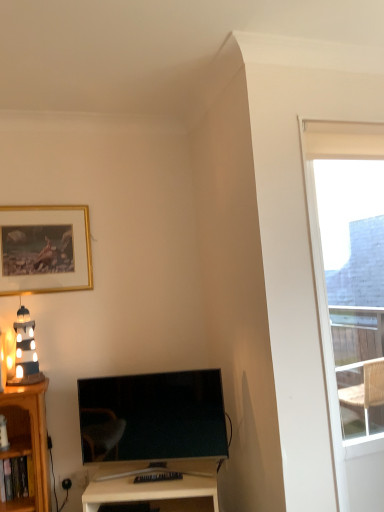
From the picture: Measure the distance between white glossy desk at center and camera.

white glossy desk at center is 1.83 meters from camera.

Describe the element at coordinates (25, 351) in the screenshot. This screenshot has height=512, width=384. I see `matte black lighthouse at left` at that location.

Where is `gold-framed picture at upper left`? The image size is (384, 512). gold-framed picture at upper left is located at coordinates (44, 249).

Do you think white glossy desk at center is within transparent glass window at upper right, or outside of it?

white glossy desk at center is not enclosed by transparent glass window at upper right.

Can you tell me how much white glossy desk at center and transparent glass window at upper right differ in facing direction?

20.7 degrees separate the facing orientations of white glossy desk at center and transparent glass window at upper right.

Is white glossy desk at center not close to transparent glass window at upper right?

That's right, there is a large distance between white glossy desk at center and transparent glass window at upper right.

Could you tell me if white glossy desk at center is turned towards transparent glass window at upper right?

No, white glossy desk at center is not facing towards transparent glass window at upper right.

Which object is closer to the camera taking this photo, matte black tv at lower center or matte black lighthouse at left?

matte black tv at lower center is closer to the camera.

Is point (101, 454) more distant than point (37, 371)?

That is False.

Considering the sizes of objects matte black tv at lower center and matte black lighthouse at left in the image provided, who is thinner, matte black tv at lower center or matte black lighthouse at left?

Thinner between the two is matte black tv at lower center.

How many degrees apart are the facing directions of matte black tv at lower center and matte black lighthouse at left?

matte black tv at lower center and matte black lighthouse at left are facing 15.3 degrees away from each other.

Is matte black tv at lower center positioned in front of white glossy desk at center?

No, matte black tv at lower center is further to the viewer.

From a real-world perspective, does matte black tv at lower center stand above white glossy desk at center?

Yes.

From the image's perspective, is matte black tv at lower center below white glossy desk at center?

No, from the image's perspective, matte black tv at lower center is not beneath white glossy desk at center.

Where is `desk located on the right of matte black tv at lower center`? The height and width of the screenshot is (512, 384). desk located on the right of matte black tv at lower center is located at coordinates (151, 483).

Is matte black tv at lower center smaller than transparent glass window at upper right?

Indeed, matte black tv at lower center has a smaller size compared to transparent glass window at upper right.

Does matte black tv at lower center have a greater width compared to transparent glass window at upper right?

Incorrect, the width of matte black tv at lower center does not surpass that of transparent glass window at upper right.

How much distance is there between matte black tv at lower center and transparent glass window at upper right?

matte black tv at lower center is 1.71 meters from transparent glass window at upper right.

From a real-world perspective, between matte black tv at lower center and transparent glass window at upper right, who is vertically higher?

transparent glass window at upper right.

Who is bigger, transparent glass window at upper right or matte black lighthouse at left?

transparent glass window at upper right is bigger.

Is transparent glass window at upper right wider or thinner than matte black lighthouse at left?

transparent glass window at upper right is thinner than matte black lighthouse at left.

From the image's perspective, which one is positioned lower, transparent glass window at upper right or matte black lighthouse at left?

matte black lighthouse at left is shown below in the image.

Between transparent glass window at upper right and gold-framed picture at upper left, which one appears on the right side from the viewer's perspective?

transparent glass window at upper right is more to the right.

Do you think transparent glass window at upper right is within gold-framed picture at upper left, or outside of it?

transparent glass window at upper right is located beyond the bounds of gold-framed picture at upper left.

Does transparent glass window at upper right have a larger size compared to gold-framed picture at upper left?

Yes, transparent glass window at upper right is bigger than gold-framed picture at upper left.

Looking at this image, from a real-world perspective, between matte black tv at lower center and gold-framed picture at upper left, who is vertically higher?

From a 3D spatial view, gold-framed picture at upper left is above.

At what (x,y) coordinates should I click in order to perform the action: click on television below the gold-framed picture at upper left (from a real-world perspective). Please return your answer as a coordinate pair (x, y). Looking at the image, I should click on (153, 416).

Between matte black tv at lower center and gold-framed picture at upper left, which one has more height?

gold-framed picture at upper left is taller.

From the image's perspective, does matte black tv at lower center appear higher than gold-framed picture at upper left?

No, from the image's perspective, matte black tv at lower center is not above gold-framed picture at upper left.

Locate an element on the screen. desk on the left of transparent glass window at upper right is located at coordinates [151, 483].

The width and height of the screenshot is (384, 512). Find the location of `television that appears in front of the matte black lighthouse at left`. television that appears in front of the matte black lighthouse at left is located at coordinates (153, 416).

Based on their spatial positions, is transparent glass window at upper right or matte black lighthouse at left closer to matte black tv at lower center?

matte black lighthouse at left.

Estimate the real-world distances between objects in this image. Which object is further from gold-framed picture at upper left, matte black lighthouse at left or matte black tv at lower center?

The object further to gold-framed picture at upper left is matte black tv at lower center.

From the image, which object appears to be nearer to transparent glass window at upper right, white glossy desk at center or gold-framed picture at upper left?

white glossy desk at center lies closer to transparent glass window at upper right than the other object.

Looking at this image, estimate the real-world distances between objects in this image. Which object is further from matte black lighthouse at left, matte black tv at lower center or white glossy desk at center?

white glossy desk at center lies further to matte black lighthouse at left than the other object.

Considering their positions, is white glossy desk at center positioned further to matte black tv at lower center than gold-framed picture at upper left?

gold-framed picture at upper left is positioned further to the anchor matte black tv at lower center.

Looking at this image, considering their positions, is transparent glass window at upper right positioned further to white glossy desk at center than matte black lighthouse at left?

transparent glass window at upper right is further to white glossy desk at center.

Looking at the image, which one is located closer to matte black tv at lower center, gold-framed picture at upper left or white glossy desk at center?

white glossy desk at center lies closer to matte black tv at lower center than the other object.

Based on their spatial positions, is white glossy desk at center or transparent glass window at upper right further from gold-framed picture at upper left?

transparent glass window at upper right is further to gold-framed picture at upper left.

Where is `television located between matte black lighthouse at left and white glossy desk at center in the left-right direction`? television located between matte black lighthouse at left and white glossy desk at center in the left-right direction is located at coordinates (153, 416).

Find the location of a particular element. The width and height of the screenshot is (384, 512). desk located between gold-framed picture at upper left and transparent glass window at upper right in the left-right direction is located at coordinates (151, 483).

This screenshot has width=384, height=512. I want to click on picture frame between matte black lighthouse at left and transparent glass window at upper right in the horizontal direction, so click(44, 249).

At what (x,y) coordinates should I click in order to perform the action: click on light fixture between gold-framed picture at upper left and matte black tv at lower center vertically. Please return your answer as a coordinate pair (x, y). Looking at the image, I should click on (25, 351).